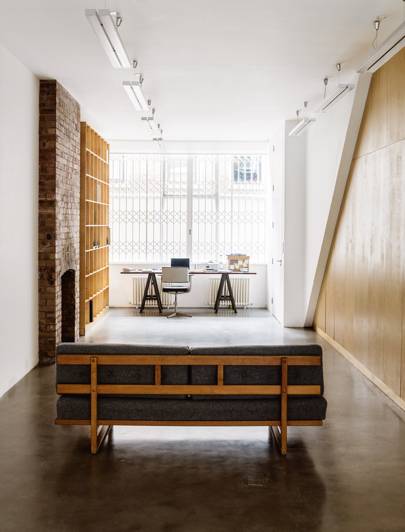
Identify the location of shiny dark brown floor. (163, 457).